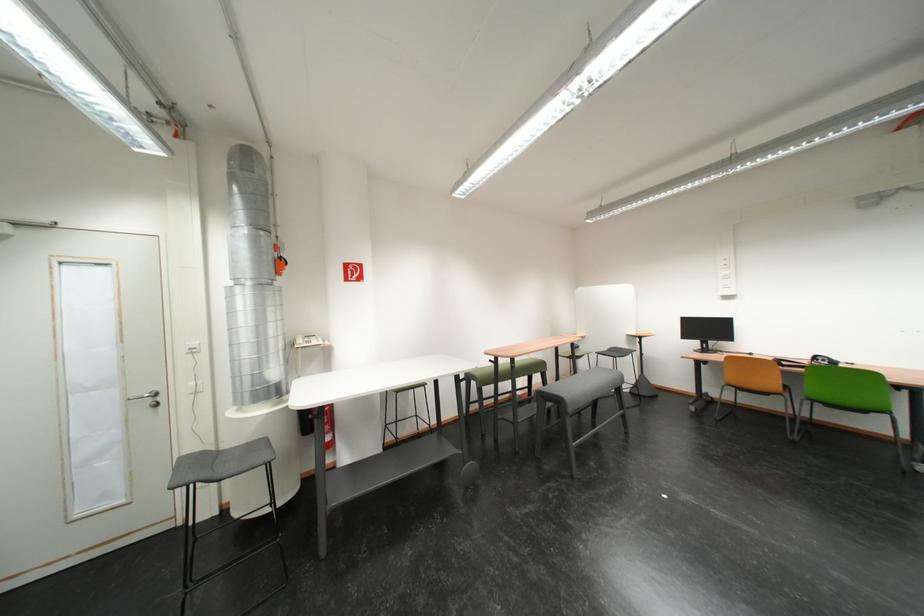
Find where to sit the gray stool sitting surface. Please return your answer as a coordinate pair (x, y).

(220, 463)